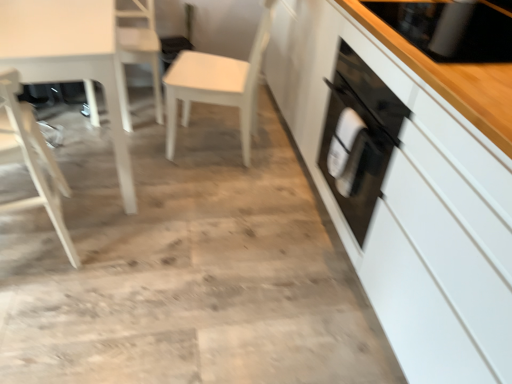
Locate an element on the screen. Image resolution: width=512 pixels, height=384 pixels. free space in front of white wood chair at left, positioned as the first chair in left-to-right order is located at coordinates (44, 311).